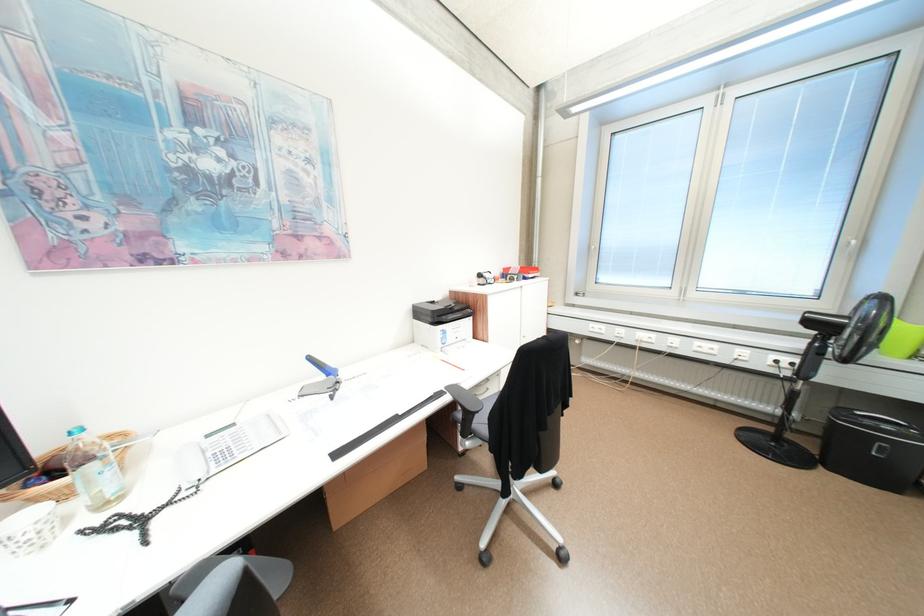
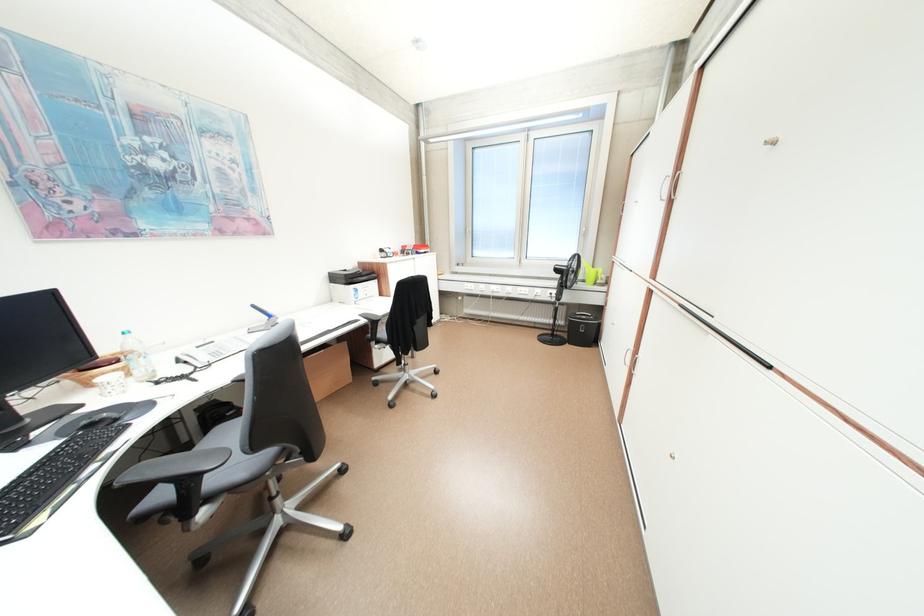
Where in the second image is the point corresponding to pixel 819 447 from the first image?

(576, 337)